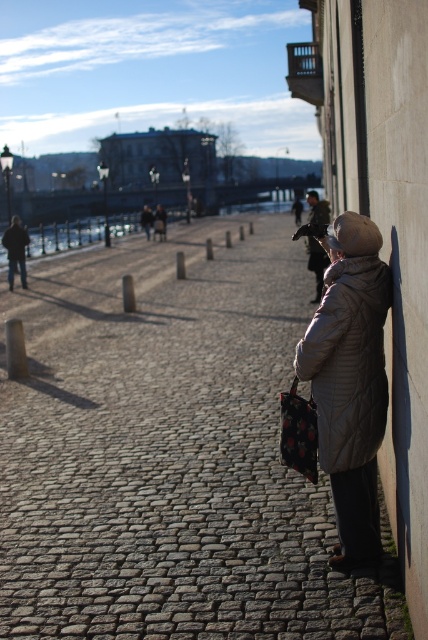
Question: Is cobblestone pavement at right wider than matte beige coat at right?

Choices:
 (A) no
 (B) yes

Answer: (B)

Question: Is the position of cobblestone pavement at right less distant than that of matte beige coat at right?

Choices:
 (A) no
 (B) yes

Answer: (B)

Question: Among these objects, which one is farthest from the camera?

Choices:
 (A) cobblestone pavement at right
 (B) matte beige coat at right

Answer: (B)

Question: Is cobblestone pavement at right closer to the viewer compared to matte beige coat at right?

Choices:
 (A) yes
 (B) no

Answer: (A)

Question: Among these objects, which one is farthest from the camera?

Choices:
 (A) matte beige coat at right
 (B) cobblestone pavement at right

Answer: (A)